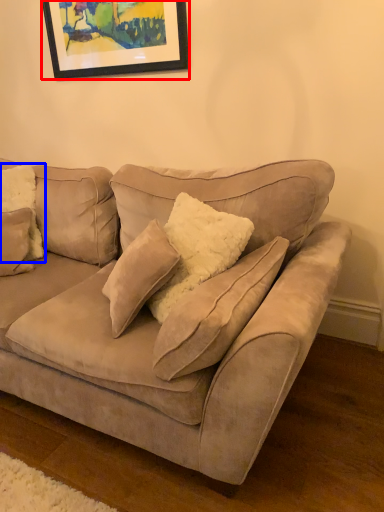
Question: Which of the following is the closest to the observer, picture frame (highlighted by a red box) or pillow (highlighted by a blue box)?

Choices:
 (A) picture frame
 (B) pillow

Answer: (B)